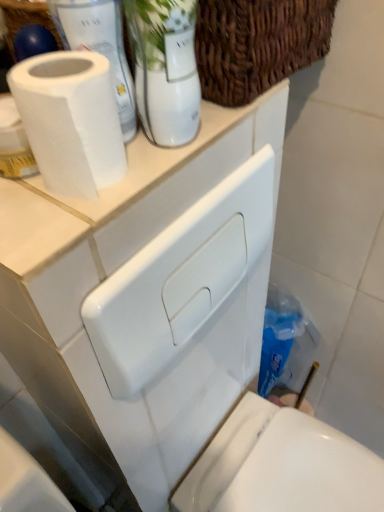
Question: Is woven brown basket at upper center oriented away from white glossy toilet at lower right?

Choices:
 (A) yes
 (B) no

Answer: (B)

Question: From the image's perspective, would you say woven brown basket at upper center is positioned over white glossy toilet at lower right?

Choices:
 (A) yes
 (B) no

Answer: (A)

Question: Is woven brown basket at upper center at the left side of white glossy toilet at lower right?

Choices:
 (A) yes
 (B) no

Answer: (A)

Question: Would you consider woven brown basket at upper center to be distant from white glossy toilet at lower right?

Choices:
 (A) yes
 (B) no

Answer: (B)

Question: Is woven brown basket at upper center next to white glossy toilet at lower right and touching it?

Choices:
 (A) no
 (B) yes

Answer: (A)

Question: In the image, is woven brown basket at upper center positioned in front of or behind white glossy toilet at lower right?

Choices:
 (A) behind
 (B) front

Answer: (B)

Question: Is woven brown basket at upper center taller or shorter than white glossy toilet at lower right?

Choices:
 (A) tall
 (B) short

Answer: (B)

Question: Is woven brown basket at upper center bigger or smaller than white glossy toilet at lower right?

Choices:
 (A) small
 (B) big

Answer: (A)

Question: From a real-world perspective, is woven brown basket at upper center physically located above or below white glossy toilet at lower right?

Choices:
 (A) below
 (B) above

Answer: (B)

Question: Visually, is white glossy toilet at lower right positioned to the left or to the right of white matte toilet paper at upper left?

Choices:
 (A) right
 (B) left

Answer: (A)

Question: Considering the positions of white glossy toilet at lower right and white matte toilet paper at upper left in the image, is white glossy toilet at lower right taller or shorter than white matte toilet paper at upper left?

Choices:
 (A) short
 (B) tall

Answer: (B)

Question: Is white glossy toilet at lower right bigger or smaller than white matte toilet paper at upper left?

Choices:
 (A) big
 (B) small

Answer: (A)

Question: Is white glossy toilet at lower right inside the boundaries of white matte toilet paper at upper left, or outside?

Choices:
 (A) inside
 (B) outside

Answer: (B)

Question: Is white glossy glass vase at upper center in front of or behind white matte paper towel at upper left in the image?

Choices:
 (A) front
 (B) behind

Answer: (A)

Question: Considering the relative positions of white glossy glass vase at upper center and white matte paper towel at upper left in the image provided, is white glossy glass vase at upper center to the left or to the right of white matte paper towel at upper left?

Choices:
 (A) left
 (B) right

Answer: (B)